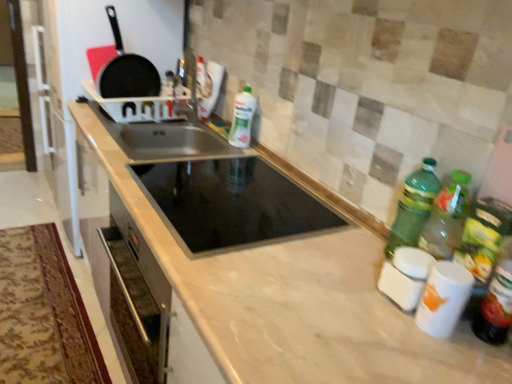
What are the coordinates of `free space to the left of white glossy canisters at lower right` in the screenshot? It's located at (351, 312).